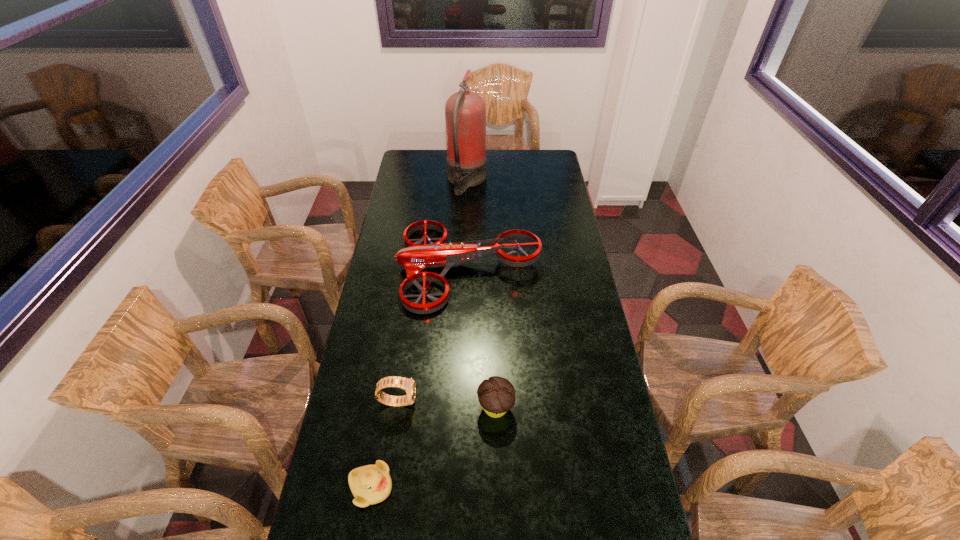
What are the coordinates of `the tallest object` in the screenshot? It's located at (465, 113).

Locate an element on the screen. The width and height of the screenshot is (960, 540). fire extinguisher is located at coordinates (465, 113).

Where is `drone`? drone is located at coordinates (416, 257).

This screenshot has width=960, height=540. What are the coordinates of `watch` in the screenshot? It's located at (408, 385).

Where is `muffin`? The image size is (960, 540). muffin is located at coordinates (496, 395).

Identify the location of duckling. This screenshot has height=540, width=960. (371, 484).

This screenshot has height=540, width=960. Identify the location of the nearest object. (371, 484).

Where is `vacant position located 0.240m at the nozzle of the tallest object`? Image resolution: width=960 pixels, height=540 pixels. vacant position located 0.240m at the nozzle of the tallest object is located at coordinates (534, 181).

You are a GUI agent. You are given a task and a screenshot of the screen. Output one action in this format:
    pyautogui.click(x=<x>, y=<y>)
    Task: Click on the vacant space located 0.060m on the left of the fourth nearest object
    The height and width of the screenshot is (540, 960).
    Given the screenshot: What is the action you would take?
    pyautogui.click(x=383, y=267)

Identify the location of vacant space located 0.230m on the face of the watch. The height and width of the screenshot is (540, 960). (490, 401).